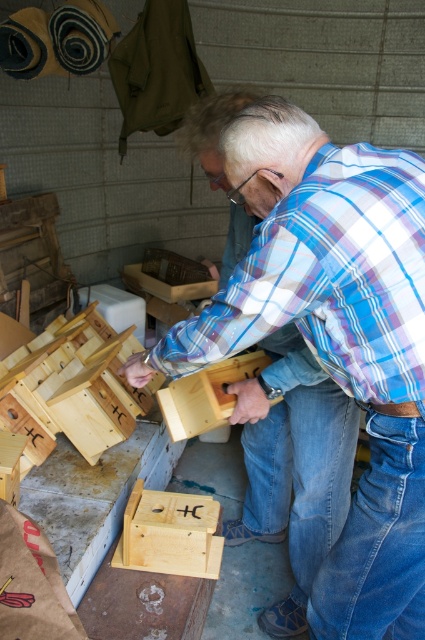
Question: Can you confirm if blue denim jeans at lower right is smaller than blue denim jeans at lower center?

Choices:
 (A) no
 (B) yes

Answer: (B)

Question: Which of the following is the closest to the observer?

Choices:
 (A) pos(368,612)
 (B) pos(289,433)

Answer: (A)

Question: Is blue denim jeans at lower right wider than blue denim jeans at lower center?

Choices:
 (A) no
 (B) yes

Answer: (A)

Question: Can you confirm if blue denim jeans at lower right is positioned to the right of blue denim jeans at lower center?

Choices:
 (A) yes
 (B) no

Answer: (A)

Question: Which object is closer to the camera taking this photo?

Choices:
 (A) blue denim jeans at lower center
 (B) blue denim jeans at lower right

Answer: (B)